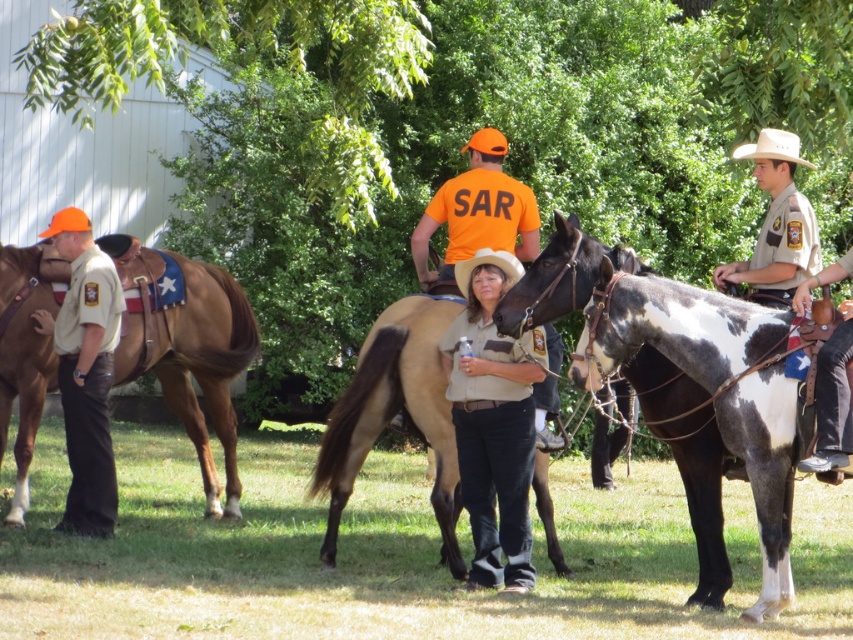
You are a photographer trying to capture a photo of the tan smooth horse at center and the brown uniform at center. If you want to frame both subjects without moving them, which subject should be placed closer to the edge of the frame to ensure both fit in the photo?

The tan smooth horse at center might be wider than the brown uniform at center, so placing the brown uniform at center closer to the edge would help both fit in the photo.